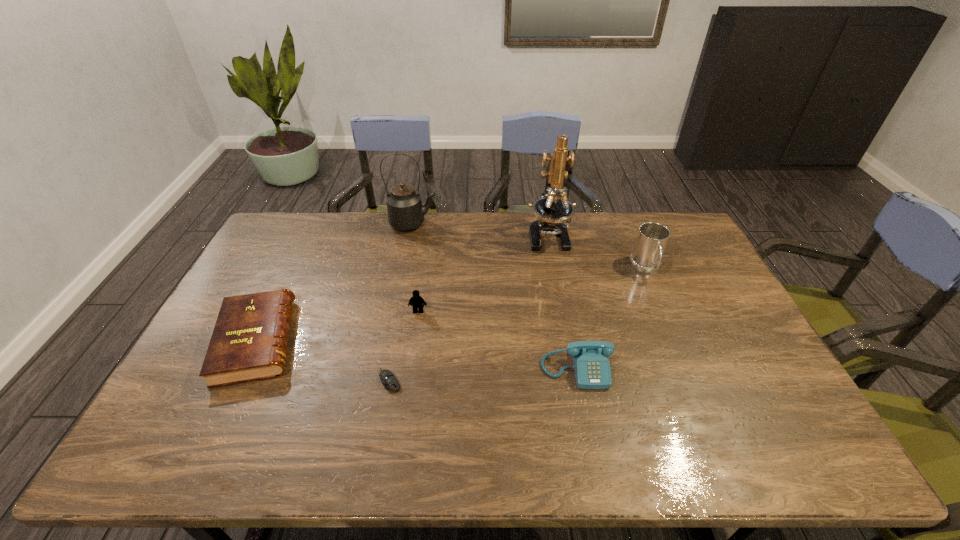
Where is `microscope`? The image size is (960, 540). microscope is located at coordinates (552, 211).

You are a GUI agent. You are given a task and a screenshot of the screen. Output one action in this format:
    pyautogui.click(x=<x>, y=<y>)
    Task: Click on the kettle
    This screenshot has width=960, height=540.
    Given the screenshot: What is the action you would take?
    [x=405, y=211]

Where is `mug`? The image size is (960, 540). mug is located at coordinates (652, 238).

Find the location of a particular element. The height and width of the screenshot is (540, 960). the rightmost object is located at coordinates pyautogui.click(x=652, y=238).

Identify the location of Lego. (417, 302).

Identify the location of the third shortest object. The width and height of the screenshot is (960, 540). (592, 370).

At what (x,y) coordinates should I click in order to perform the action: click on the leftmost object. Please return your answer as a coordinate pair (x, y). This screenshot has height=540, width=960. Looking at the image, I should click on (249, 342).

In order to click on the second shortest object in this screenshot , I will do `click(249, 342)`.

Locate an element on the screen. computer mouse is located at coordinates (390, 382).

Image resolution: width=960 pixels, height=540 pixels. I want to click on free region located 0.270m at the eyepiece of the microscope, so click(563, 313).